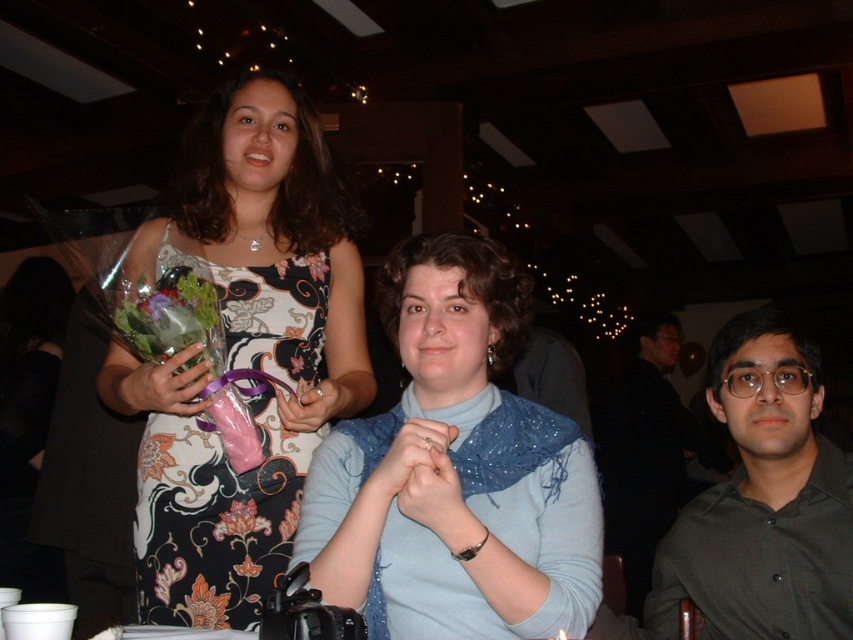
You are a photographer at a social gathering and want to ensure both the floral pattern fabric at center and the orange matte flower at center are clearly visible in your photo. Given their heights, which object might you need to adjust your camera angle to capture fully?

The floral pattern fabric at center has a greater height compared to the orange matte flower at center. To capture both fully, you might need to lower your camera angle to accommodate the taller floral pattern fabric at center.

Consider the image. You are standing in the banquet hall and see the floral pattern fabric at center. Can you estimate its position using the coordinate system where the bottom left corner is the origin?

The floral pattern fabric at center is located at the coordinate point of 0.947 on the x axis and 0.240 on the y axis.